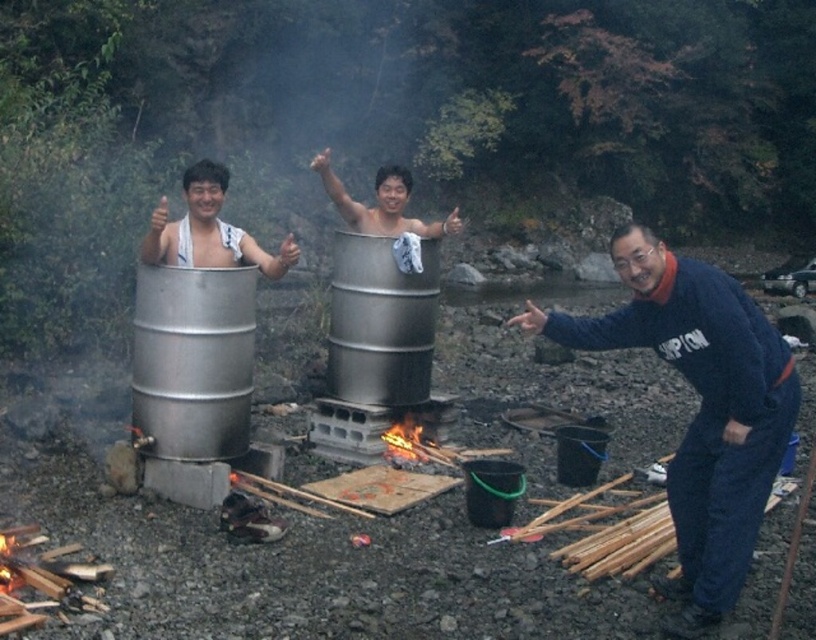
Who is higher up, silver metallic tub at center or charcoal wood fire at center?

Positioned higher is silver metallic tub at center.

Between silver metallic tub at center and charcoal wood fire at center, which one has more height?

Standing taller between the two is silver metallic tub at center.

Is point (191, 257) closer to camera compared to point (395, 445)?

Yes.

Where is `silver metallic tub at center`? The image size is (816, 640). silver metallic tub at center is located at coordinates (207, 228).

Which is more to the right, blue fleece jacket at lower right or charcoal wood fire at center?

blue fleece jacket at lower right is more to the right.

The width and height of the screenshot is (816, 640). What do you see at coordinates (699, 406) in the screenshot?
I see `blue fleece jacket at lower right` at bounding box center [699, 406].

The width and height of the screenshot is (816, 640). In order to click on blue fleece jacket at lower right in this screenshot , I will do click(699, 406).

Can you confirm if blue fleece jacket at lower right is taller than silver metallic tub at center?

Yes.

Between blue fleece jacket at lower right and silver metallic tub at center, which one appears on the right side from the viewer's perspective?

blue fleece jacket at lower right is more to the right.

Image resolution: width=816 pixels, height=640 pixels. Describe the element at coordinates (699, 406) in the screenshot. I see `blue fleece jacket at lower right` at that location.

Identify the location of blue fleece jacket at lower right. This screenshot has height=640, width=816. (699, 406).